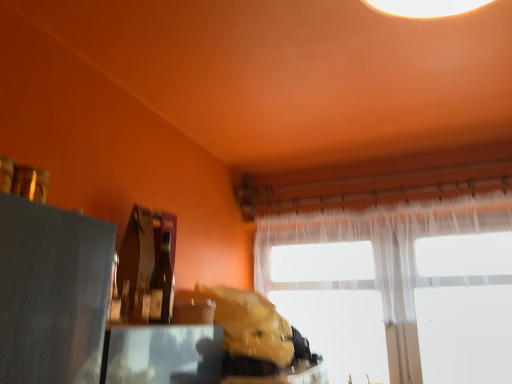
Question: Looking at the image, does matte black table at lower left seem bigger or smaller compared to leather-like brown bag at center?

Choices:
 (A) small
 (B) big

Answer: (B)

Question: Would you say matte black table at lower left is inside or outside leather-like brown bag at center?

Choices:
 (A) outside
 (B) inside

Answer: (A)

Question: Estimate the real-world distances between objects in this image. Which object is farther from the matte black table at lower left?

Choices:
 (A) translucent fabric window at center
 (B) matte glass bottle at center
 (C) leather-like brown bag at center

Answer: (A)

Question: Estimate the real-world distances between objects in this image. Which object is farther from the matte glass bottle at center?

Choices:
 (A) leather-like brown bag at center
 (B) translucent fabric window at center
 (C) matte black table at lower left

Answer: (B)